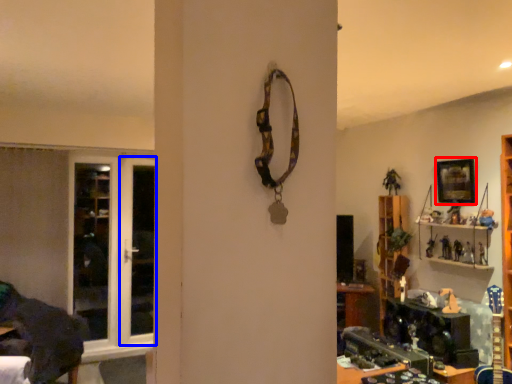
Question: Which of the following is the farthest to the observer, picture frame (highlighted by a red box) or screen door (highlighted by a blue box)?

Choices:
 (A) picture frame
 (B) screen door

Answer: (B)